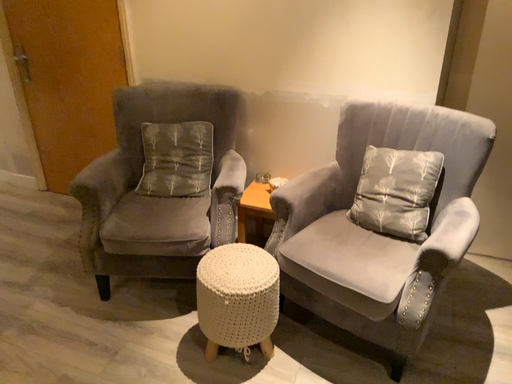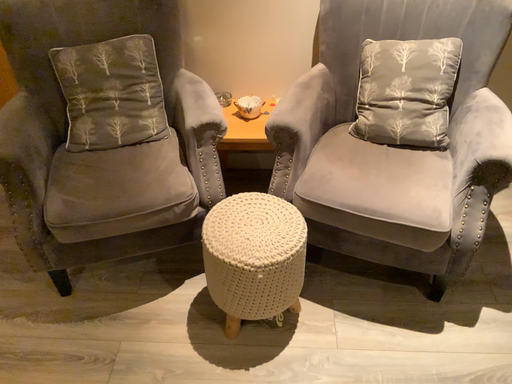
Question: How did the camera likely rotate when shooting the video?

Choices:
 (A) rotated downward
 (B) rotated upward

Answer: (A)